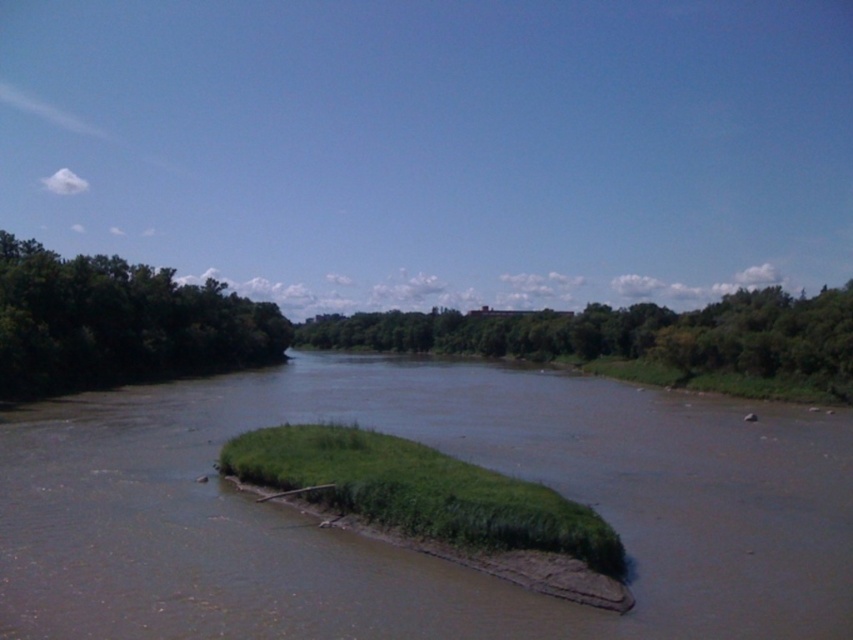
You are a kayaker planning to cross the river. You need to know if the brown muddy river at center is wider than the green leafy trees at left. Can you confirm this?

The brown muddy river at center is wider than the green leafy trees at left according to the description.

You are standing at the riverbank and want to take a photo of both the point at coordinates point (772, 356) and point (592, 528). Which point will appear closer to the camera in your photo?

Point (592, 528) will appear closer to the camera in the photo because it is closer to the viewer than point (772, 356).